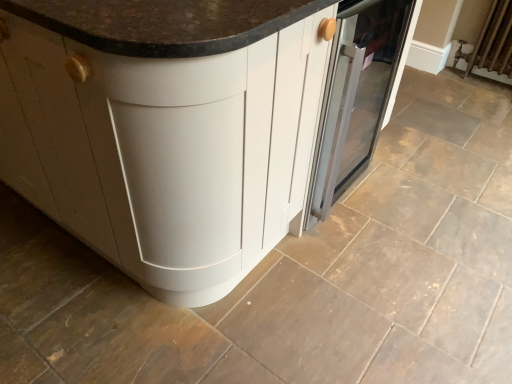
Question: Can you confirm if white matte cabinet at center is smaller than satin silver oven at center?

Choices:
 (A) yes
 (B) no

Answer: (B)

Question: Is satin silver oven at center surrounded by white matte cabinet at center?

Choices:
 (A) yes
 (B) no

Answer: (A)

Question: Does white matte cabinet at center come in front of satin silver oven at center?

Choices:
 (A) yes
 (B) no

Answer: (A)

Question: Considering the relative sizes of white matte cabinet at center and satin silver oven at center in the image provided, is white matte cabinet at center bigger than satin silver oven at center?

Choices:
 (A) no
 (B) yes

Answer: (B)

Question: Does white matte cabinet at center have a greater height compared to satin silver oven at center?

Choices:
 (A) no
 (B) yes

Answer: (B)

Question: From a real-world perspective, relative to satin silver oven at center, is white matte cabinet at center vertically above or below?

Choices:
 (A) below
 (B) above

Answer: (B)

Question: In the image, is white matte cabinet at center on the left side or the right side of satin silver oven at center?

Choices:
 (A) right
 (B) left

Answer: (B)

Question: From the image's perspective, is white matte cabinet at center above or below satin silver oven at center?

Choices:
 (A) above
 (B) below

Answer: (A)

Question: Is white matte cabinet at center situated inside satin silver oven at center or outside?

Choices:
 (A) outside
 (B) inside

Answer: (A)

Question: Is satin silver oven at center situated inside brown fabric radiator at upper right or outside?

Choices:
 (A) inside
 (B) outside

Answer: (B)

Question: Is satin silver oven at center taller or shorter than brown fabric radiator at upper right?

Choices:
 (A) tall
 (B) short

Answer: (A)

Question: From a real-world perspective, is satin silver oven at center physically located above or below brown fabric radiator at upper right?

Choices:
 (A) below
 (B) above

Answer: (B)

Question: From the image's perspective, relative to brown fabric radiator at upper right, is satin silver oven at center above or below?

Choices:
 (A) below
 (B) above

Answer: (A)

Question: From the image's perspective, relative to satin silver oven at center, is brown fabric radiator at upper right above or below?

Choices:
 (A) below
 (B) above

Answer: (B)

Question: From a real-world perspective, relative to satin silver oven at center, is brown fabric radiator at upper right vertically above or below?

Choices:
 (A) below
 (B) above

Answer: (A)